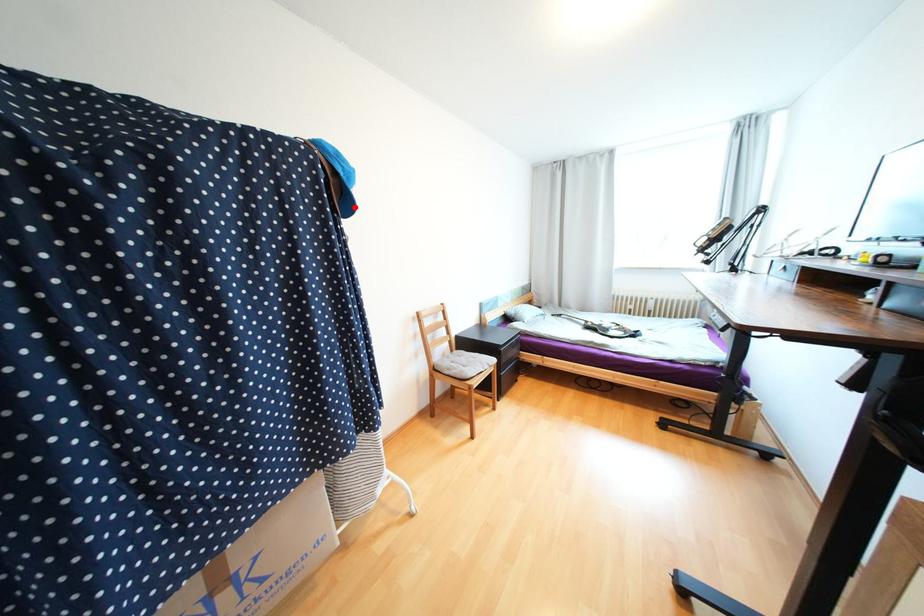
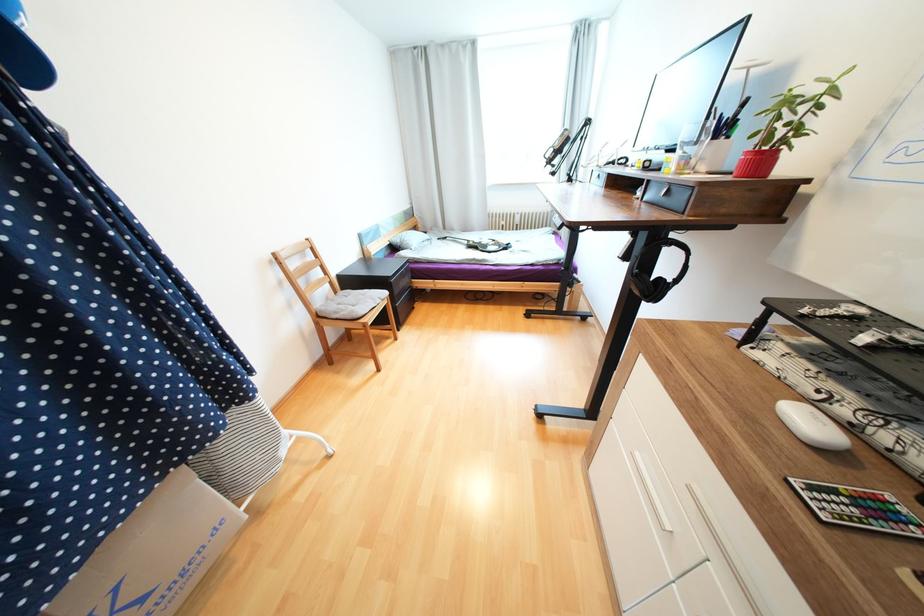
Question: I am providing you with two images of the same scene from different viewpoints. Image1 has a red point marked. In image2, the corresponding 3D location appears at what relative position? Reply with the corresponding letter.

Choices:
 (A) Closer
 (B) Farther

Answer: (B)